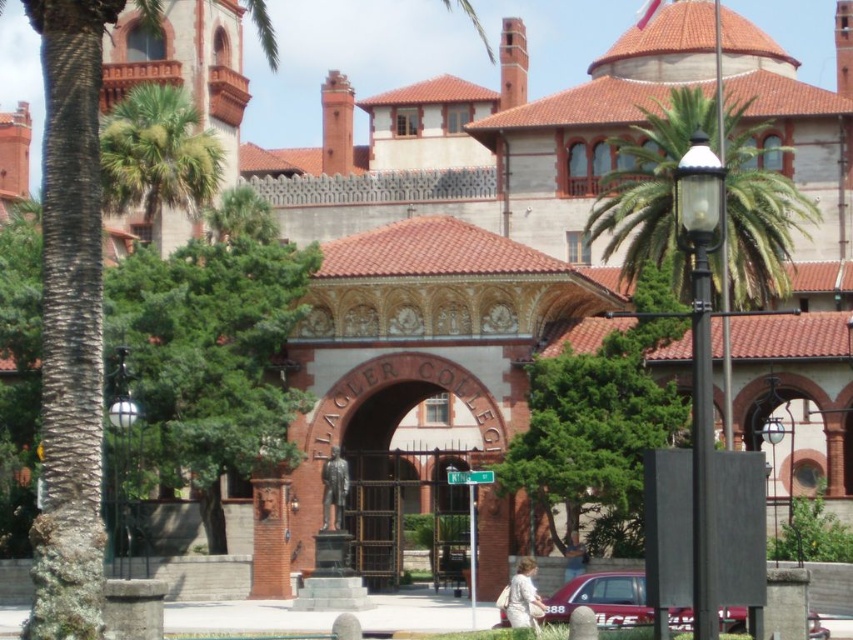
You are standing at the entrance of Flagler College and see two points marked on the archway. The first point is at coordinate (680, 131) and the second at (131, 196). Which point is closer to you as you face the archway?

Point (680, 131) is in front of point (131, 196), so it is closer to you when facing the archway.

You are a visitor approaching the entrance of Flagler College and see the green leafy palm tree at upper left and the metallic red car at lower center. Which object is taller?

The green leafy palm tree at upper left is taller than the metallic red car at lower center according to the description.